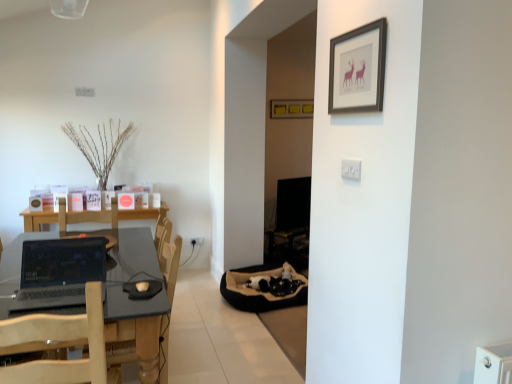
Question: Relative to matte yellow picture frame at center, arranged as the second picture frame when ordered from the bottom, is white plastic electric outlet at center, the 1th electric outlet when ordered from left to right, in front or behind?

Choices:
 (A) front
 (B) behind

Answer: (A)

Question: Looking at the image, does white plastic electric outlet at center, the 1th electric outlet when ordered from left to right, seem bigger or smaller compared to matte yellow picture frame at center, arranged as the 2th picture frame when viewed from the front?

Choices:
 (A) big
 (B) small

Answer: (B)

Question: Which of these objects is positioned farthest from the dark gray laminate table at left?

Choices:
 (A) white plastic electric outlet at center, which is the second electric outlet in right-to-left order
 (B) white plastic electric outlet at upper center, placed as the second electric outlet when sorted from left to right
 (C) black glossy laptop at left
 (D) black glossy monitor at center
 (E) wooden chair at left

Answer: (D)

Question: Which is nearer to the dark gray laminate table at left?

Choices:
 (A) wooden chair at left
 (B) black glossy monitor at center
 (C) white plastic electric outlet at center, placed as the 1th electric outlet when sorted from bottom to top
 (D) matte yellow picture frame at center, the 1th picture frame viewed from the top
 (E) white plastic electric outlet at upper center, which ranks as the first electric outlet in right-to-left order

Answer: (A)